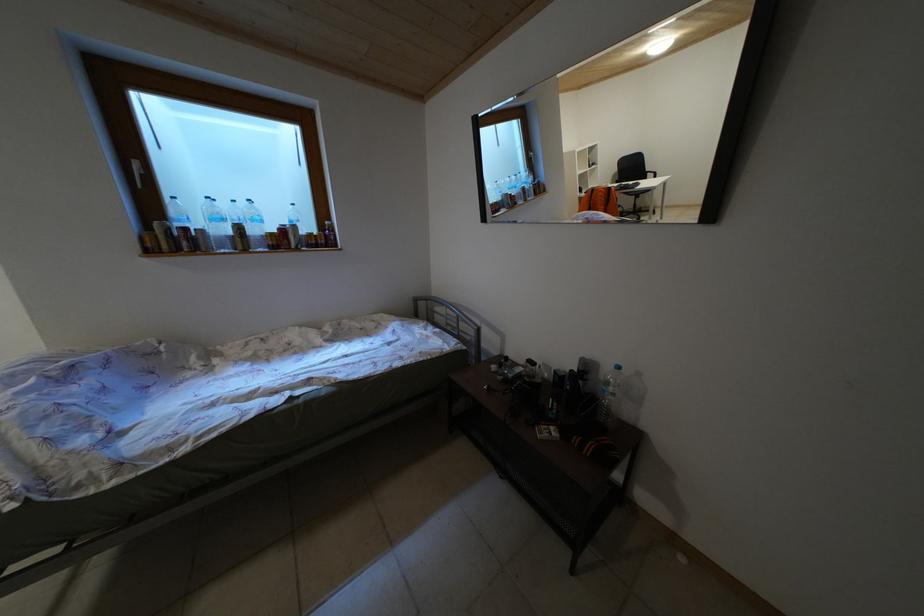
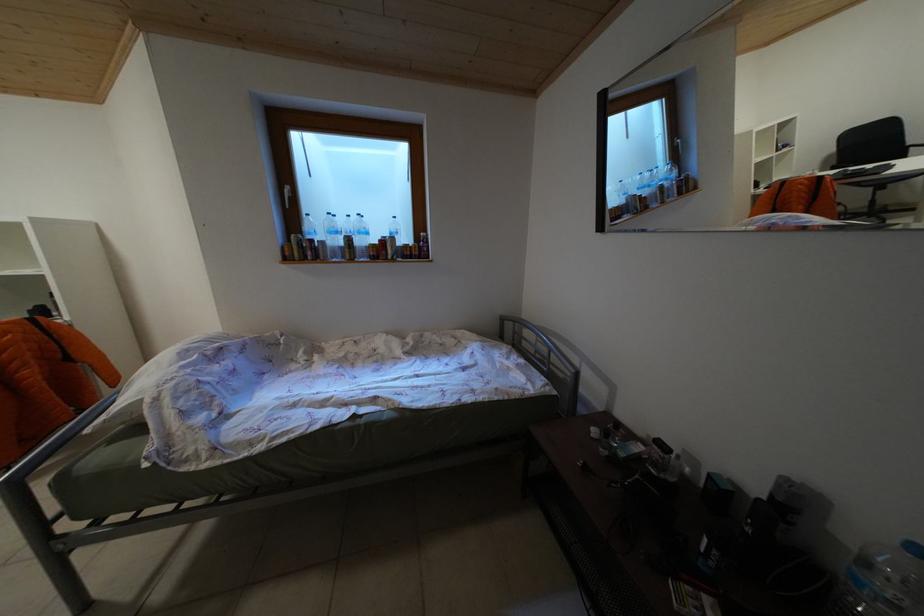
Question: Based on the continuous images, in which direction is the camera rotating? Reply with the corresponding letter.

Choices:
 (A) Left
 (B) Right
 (C) Up
 (D) Down

Answer: (A)